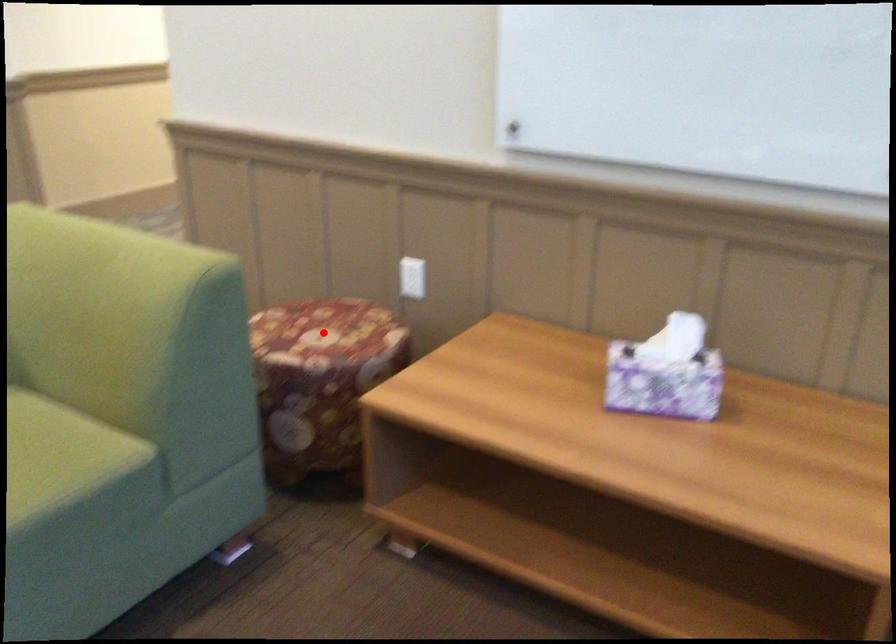
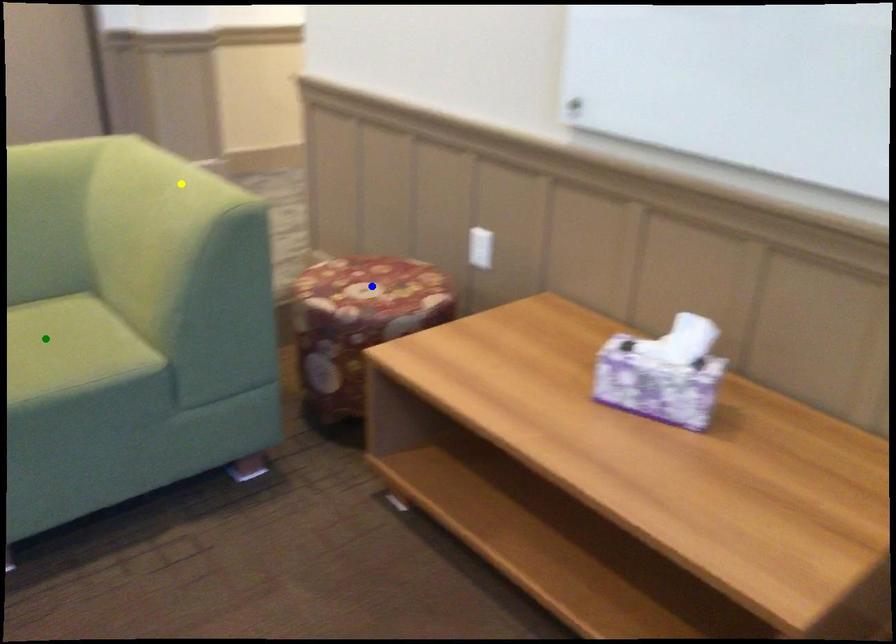
Question: I am providing you with two images of the same scene from different viewpoints. A red point is marked on the first image. You are given multiple points on the second image. Which mark in image 2 goes with the point in image 1?

Choices:
 (A) green point
 (B) yellow point
 (C) blue point

Answer: (C)